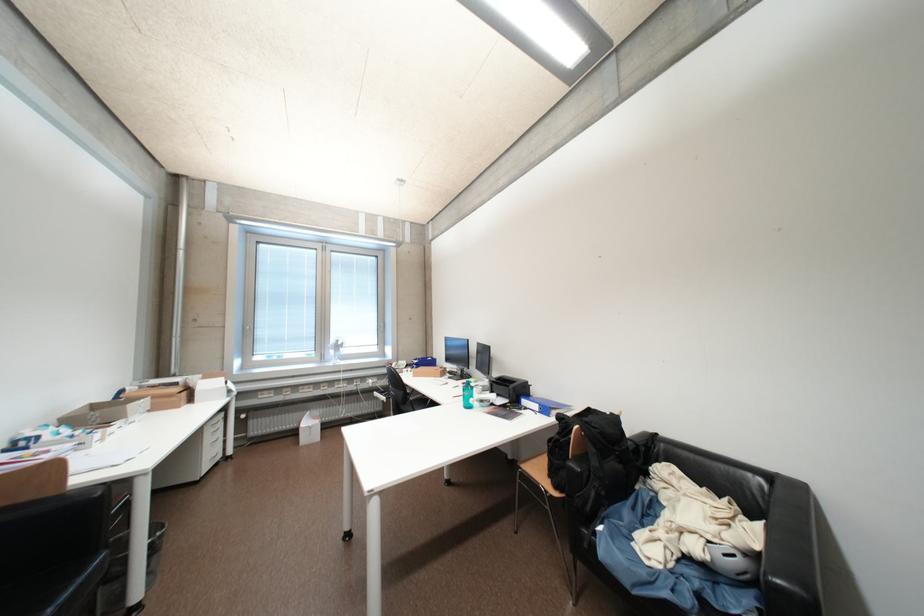
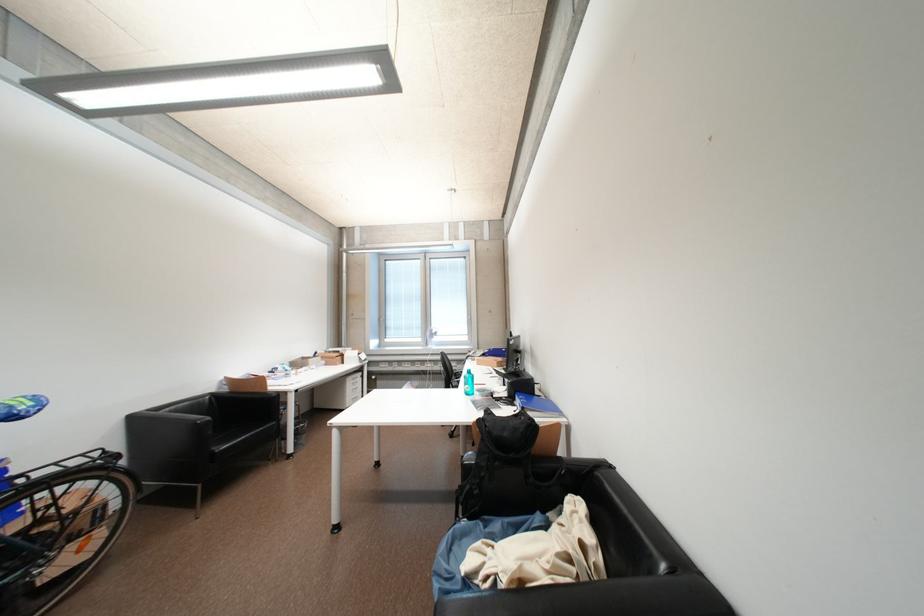
Find the pixel in the second image that matches point 602,430 in the first image.

(493, 428)